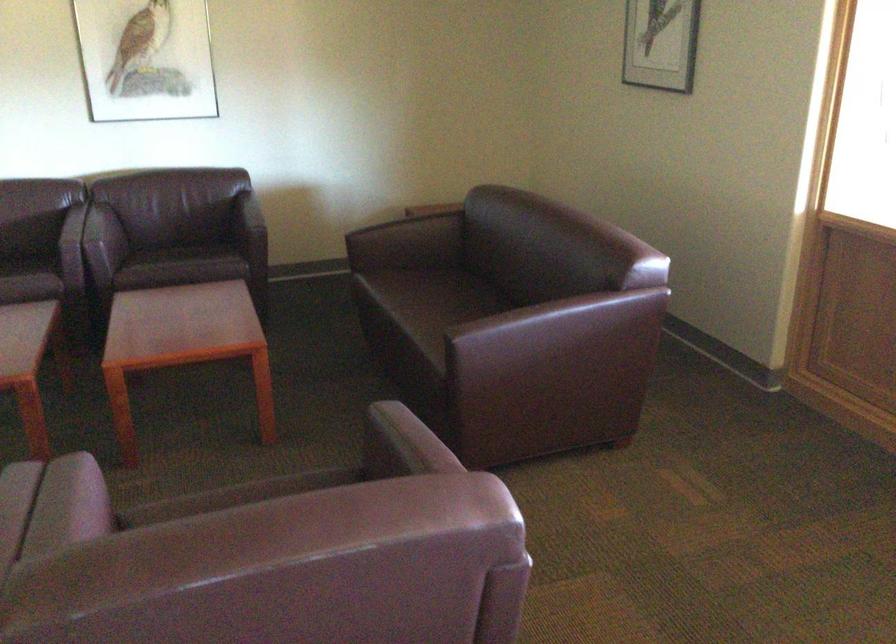
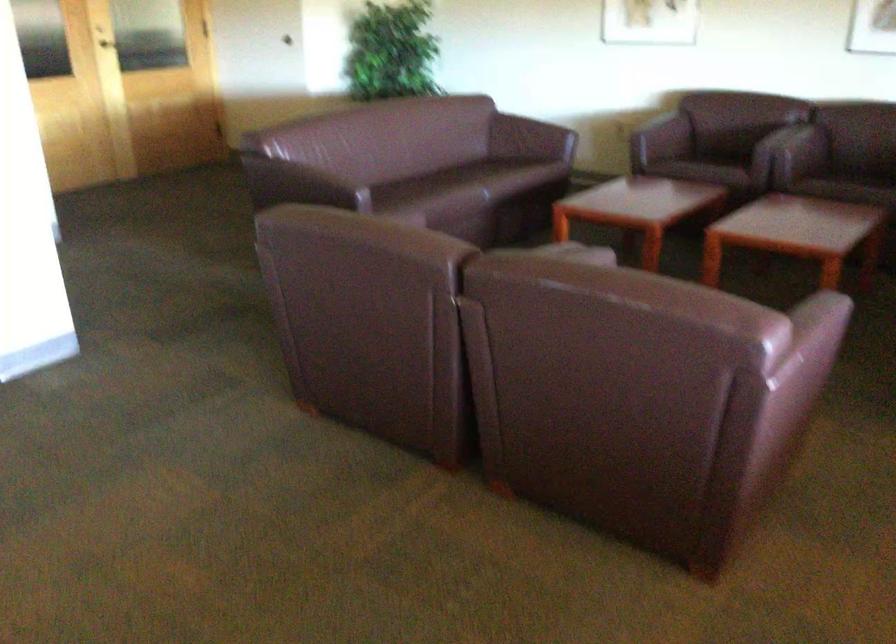
Locate, in the second image, the point that corresponds to point (192, 277) in the first image.

(853, 185)